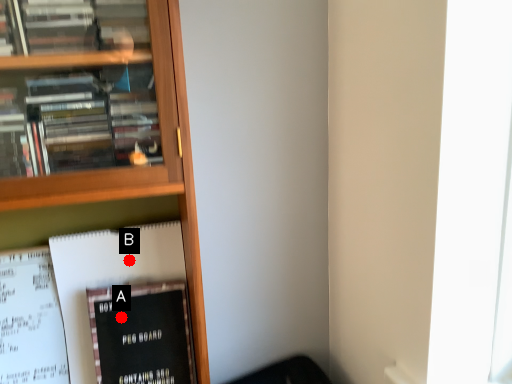
Question: Two points are circled on the image, labeled by A and B beside each circle. Which of the following is the closest to the observer?

Choices:
 (A) A is closer
 (B) B is closer

Answer: (A)